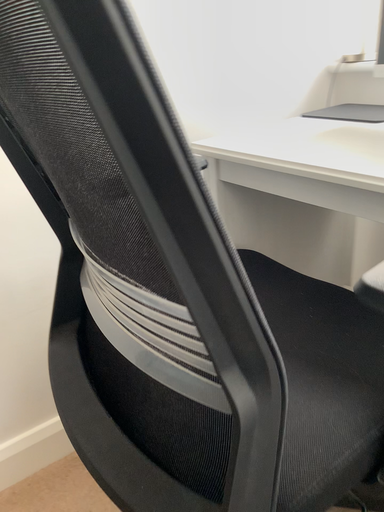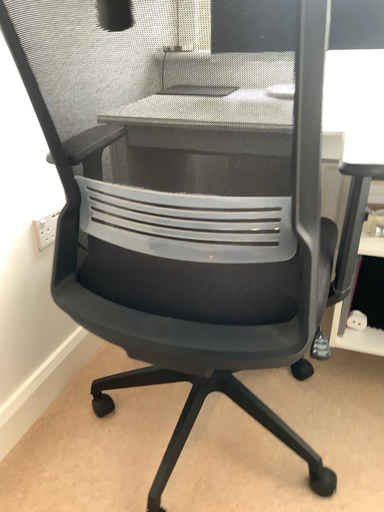
Question: How did the camera likely rotate when shooting the video?

Choices:
 (A) rotated right
 (B) rotated left

Answer: (A)